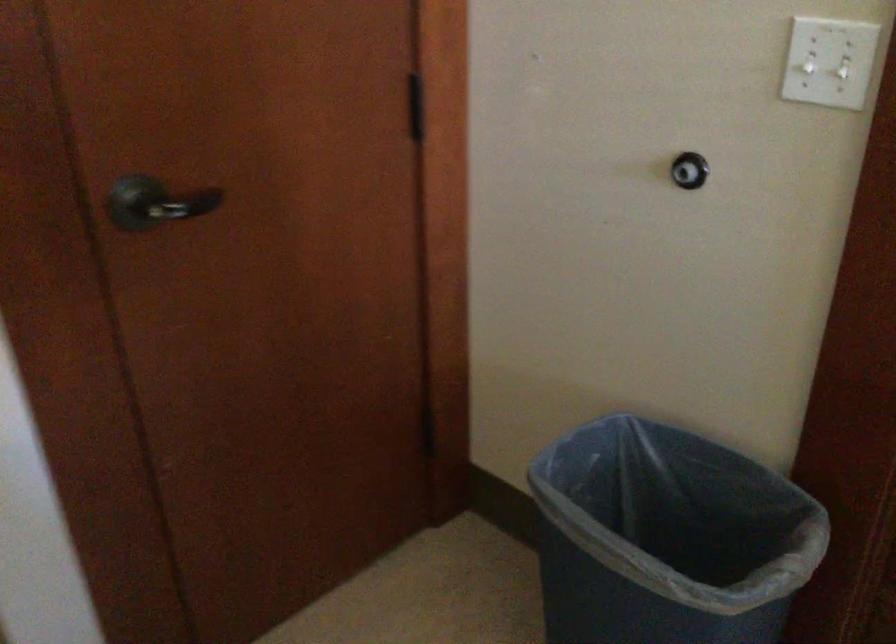
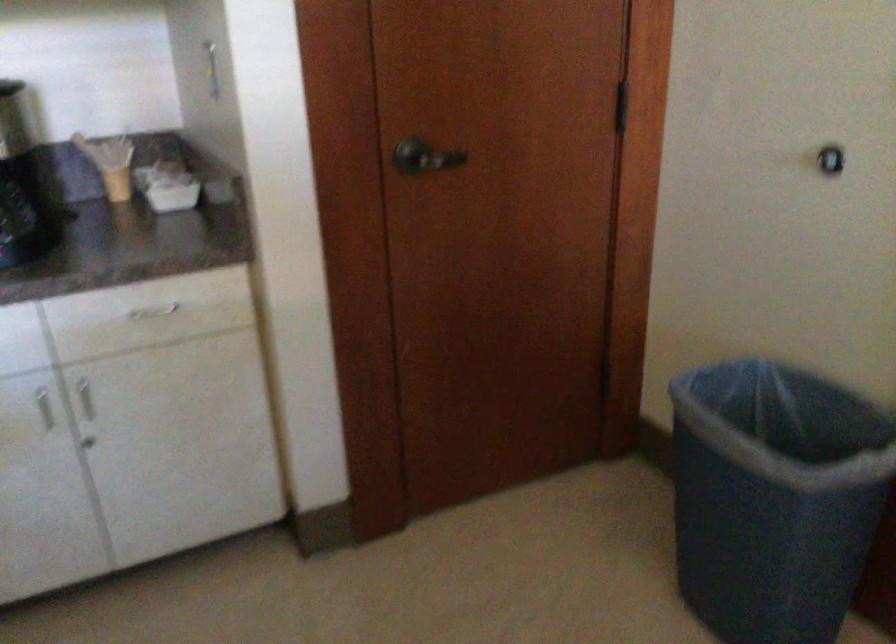
Where in the second image is the point corresponding to [667,538] from the first image?

(788, 466)